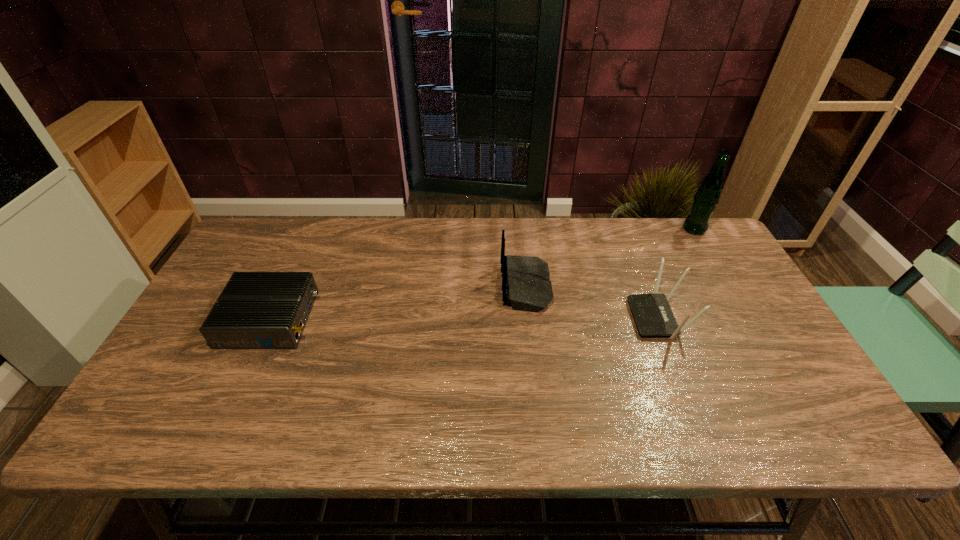
This screenshot has width=960, height=540. Find the location of `empty space that is in between the tallest object and the second router from right to left`. empty space that is in between the tallest object and the second router from right to left is located at coordinates (611, 258).

The image size is (960, 540). What are the coordinates of `vacant point located between the beer bottle and the second object from left to right` in the screenshot? It's located at (611, 258).

Image resolution: width=960 pixels, height=540 pixels. I want to click on vacant point located between the second router from left to right and the shortest router, so click(x=398, y=302).

Where is `free space between the second router from right to left and the rightmost object`? free space between the second router from right to left and the rightmost object is located at coordinates (611, 258).

Where is `vacant space in between the rightmost router and the third object from right to left`? The height and width of the screenshot is (540, 960). vacant space in between the rightmost router and the third object from right to left is located at coordinates (592, 302).

The image size is (960, 540). I want to click on free space that is in between the second router from right to left and the second object from right to left, so click(592, 302).

Locate an element on the screen. free spot between the leftmost router and the second shortest object is located at coordinates (465, 318).

The image size is (960, 540). Find the location of `object that stands as the third closest to the shortest object`. object that stands as the third closest to the shortest object is located at coordinates (707, 196).

Identify the location of the second closest object to the farthest object. The image size is (960, 540). (526, 286).

Locate which router ranks second in proximity to the second object from left to right. Please provide its 2D coordinates. Your answer should be formatted as a tuple, i.e. [(x, y)], where the tuple contains the x and y coordinates of a point satisfying the conditions above.

[(256, 310)]